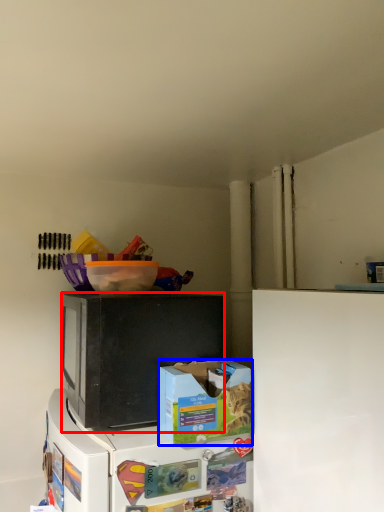
Question: Among these objects, which one is nearest to the camera, microwave oven (highlighted by a red box) or box (highlighted by a blue box)?

Choices:
 (A) microwave oven
 (B) box

Answer: (B)